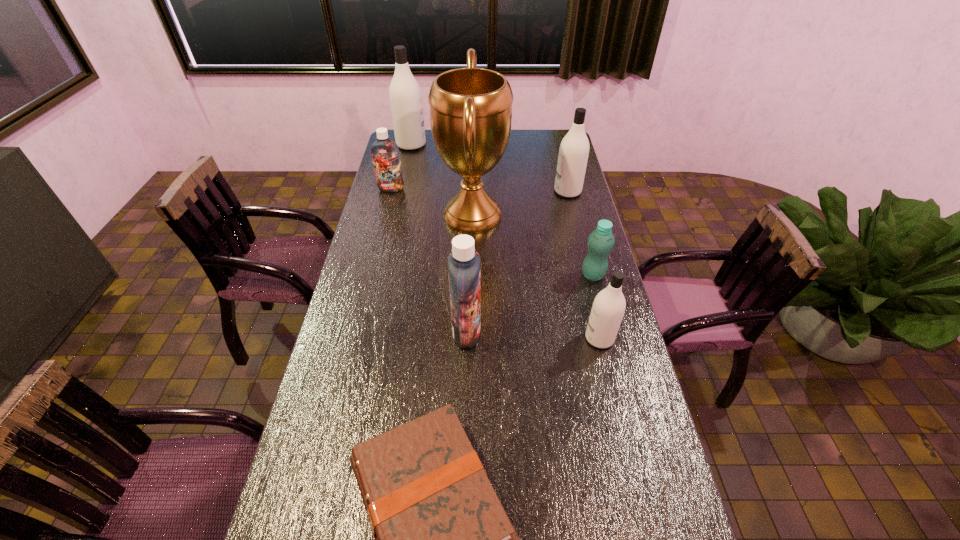
Where is `vacant space situated 0.320m on the front-facing side of the smallest white shampoo`? The image size is (960, 540). vacant space situated 0.320m on the front-facing side of the smallest white shampoo is located at coordinates (479, 338).

Where is `blank space located on the front label of the farther blue shampoo`? The height and width of the screenshot is (540, 960). blank space located on the front label of the farther blue shampoo is located at coordinates (381, 229).

Find the location of `vacant space located at the front cap of the second shortest object`. vacant space located at the front cap of the second shortest object is located at coordinates (488, 275).

I want to click on free space located at the front cap of the second shortest object, so click(x=491, y=275).

At what (x,y) coordinates should I click in order to perform the action: click on free location located at the front cap of the second shortest object. Please return your answer as a coordinate pair (x, y). Looking at the image, I should click on [x=479, y=275].

I want to click on object that is positioned at the far edge, so click(x=405, y=95).

Where is `water bottle situated at the right edge`? The height and width of the screenshot is (540, 960). water bottle situated at the right edge is located at coordinates (601, 241).

Find the location of a particular element. Image resolution: width=960 pixels, height=540 pixels. object that is at the far left corner is located at coordinates (405, 95).

At what (x,y) coordinates should I click in order to perform the action: click on vacant area at the left edge of the desktop. Please return your answer as a coordinate pair (x, y). Looking at the image, I should click on (322, 486).

Find the location of a particular element. vacant space at the right edge is located at coordinates (609, 359).